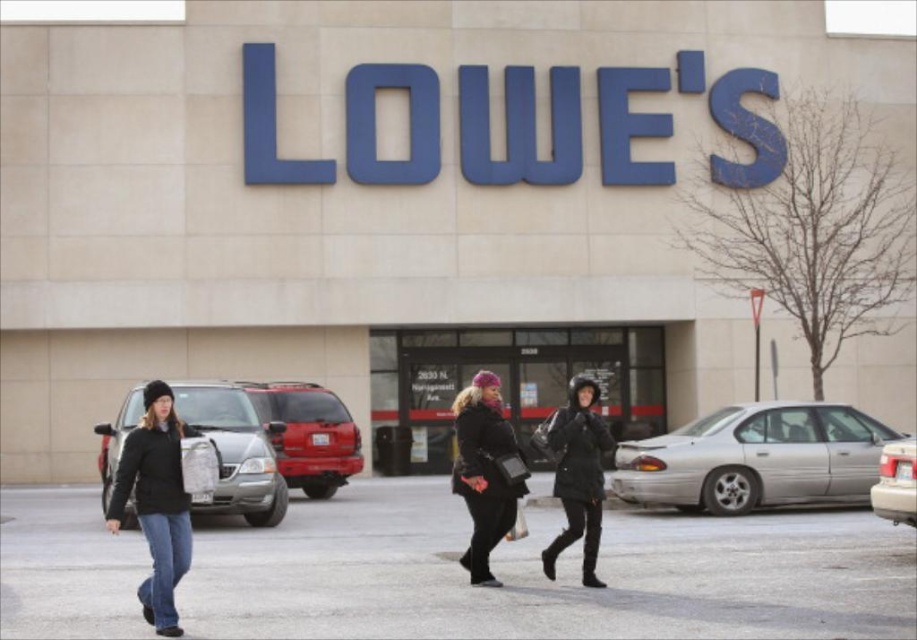
Consider the image. You are standing in the parking lot of the Lowe store and see the velvet black coat at center and the silver metallic sedan at lower right. Which object is closer to the ground?

The velvet black coat at center is below silver metallic sedan at lower right, so the velvet black coat at center is closer to the ground.

You are a delivery person who needs to place a large package in a storage bin. The bin can only hold items that are narrower than the silver metallic sedan at lower right. Can the velvet black coat at center fit into the bin?

The velvet black coat at center is wider than the silver metallic sedan at lower right, so it cannot fit into the storage bin.

You are standing in the parking lot of the Lowe s store and want to enter the store. Which direction should you walk to reach the black matte storefront at center?

The black matte storefront at center is located at point [506,381], so you should walk towards the center of the store s facade to reach it.